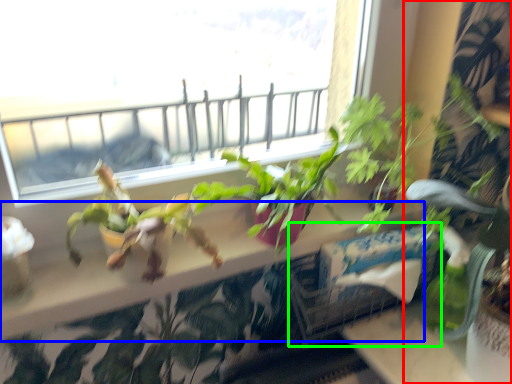
Question: Which object is positioned farthest from houseplant (highlighted by a red box)? Select from window sill (highlighted by a blue box) and window box (highlighted by a green box).

Choices:
 (A) window sill
 (B) window box

Answer: (A)